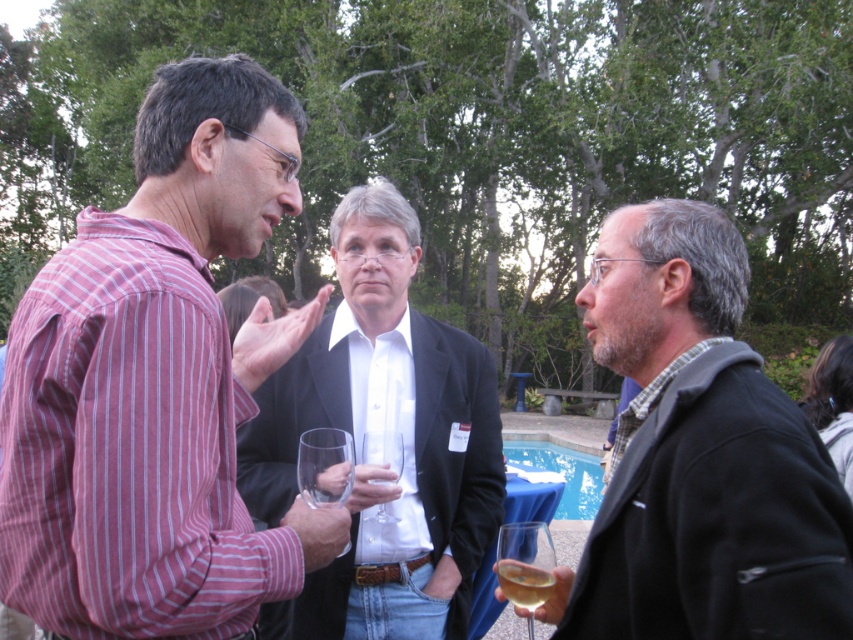
Who is shorter, gray wool jacket at right or white shirt at center?

Standing shorter between the two is gray wool jacket at right.

Does gray wool jacket at right have a lesser width compared to white shirt at center?

Yes, gray wool jacket at right is thinner than white shirt at center.

Does point (698, 291) come closer to viewer compared to point (467, 451)?

Yes.

Find the location of a particular element. The width and height of the screenshot is (853, 640). gray wool jacket at right is located at coordinates (699, 456).

Does white shirt at center have a smaller size compared to translucent glass wine glass at lower right?

No, white shirt at center is not smaller than translucent glass wine glass at lower right.

Between white shirt at center and translucent glass wine glass at lower right, which one has less height?

With less height is translucent glass wine glass at lower right.

You are a GUI agent. You are given a task and a screenshot of the screen. Output one action in this format:
    pyautogui.click(x=<x>, y=<y>)
    Task: Click on the white shirt at center
    This screenshot has width=853, height=640.
    Given the screenshot: What is the action you would take?
    pyautogui.click(x=387, y=428)

Is the position of translucent glass wine glass at lower right more distant than that of translucent glass wine at lower right?

Yes, translucent glass wine glass at lower right is further from the viewer.

Locate an element on the screen. Image resolution: width=853 pixels, height=640 pixels. translucent glass wine glass at lower right is located at coordinates (525, 564).

Is point (503, 580) positioned behind point (531, 577)?

Yes.

This screenshot has height=640, width=853. Find the location of `translucent glass wine glass at lower right`. translucent glass wine glass at lower right is located at coordinates (525, 564).